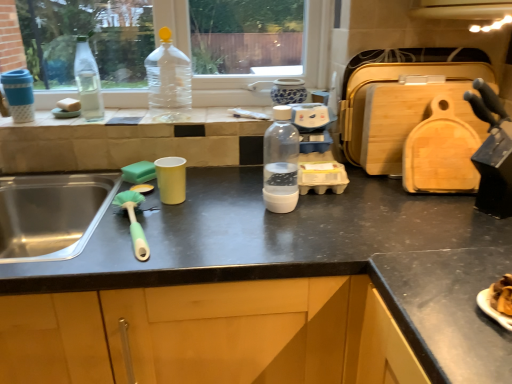
The width and height of the screenshot is (512, 384). In order to click on vacant area on the back side of green plastic brush at left in this screenshot , I will do `click(159, 203)`.